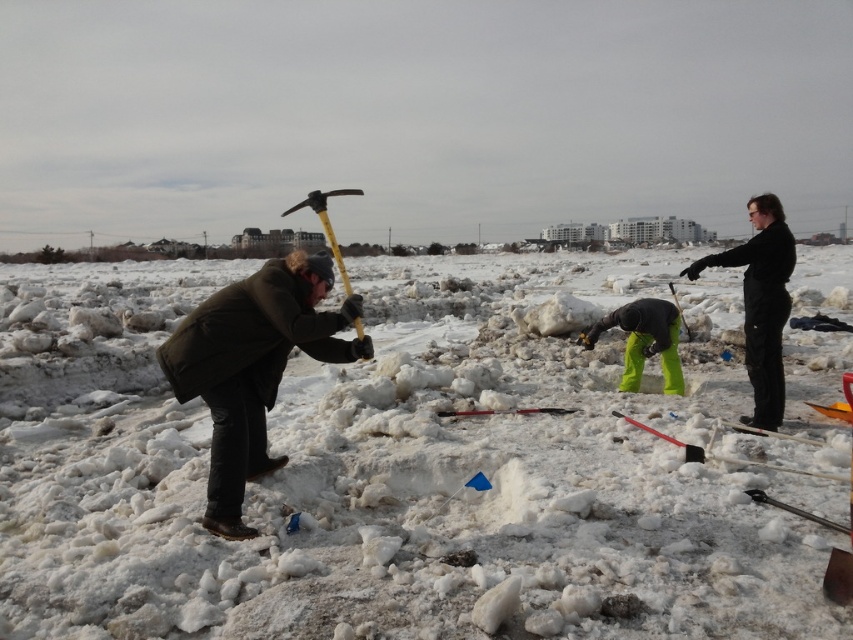
You are standing at the point with coordinates point (212, 390) and want to walk to the point with coordinates point (558, 410). Which direction should you face to move towards the second point?

You should face southwest to move from point (212, 390) to point (558, 410) because the second point is located southwest of the first point.

You are a delivery robot with a 1.5 meter wide package. You need to move through the space between the green fabric pants at center and the smooth plastic shovel at center. Can your package fit through the gap?

The gap between the green fabric pants at center and the smooth plastic shovel at center is 1.71 meters. Since the package is 1.5 meters wide, it can fit through the gap as there is enough space.

You are standing in the snowy outdoor scene and want to place a small flag at the point closer to you. Which point should you choose between point (613, 317) and point (451, 413)?

Point (451, 413) is closer to you, so you should place the flag there.